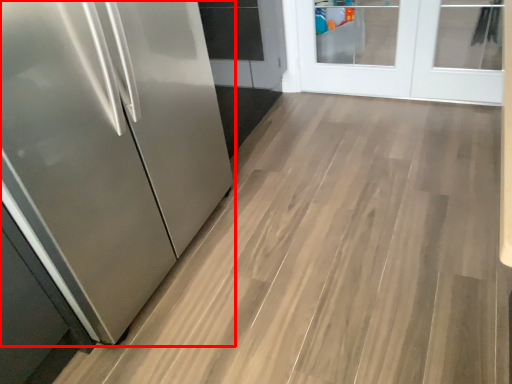
Question: Where is refrigerator (annotated by the red box) located in relation to door in the image?

Choices:
 (A) left
 (B) right

Answer: (A)